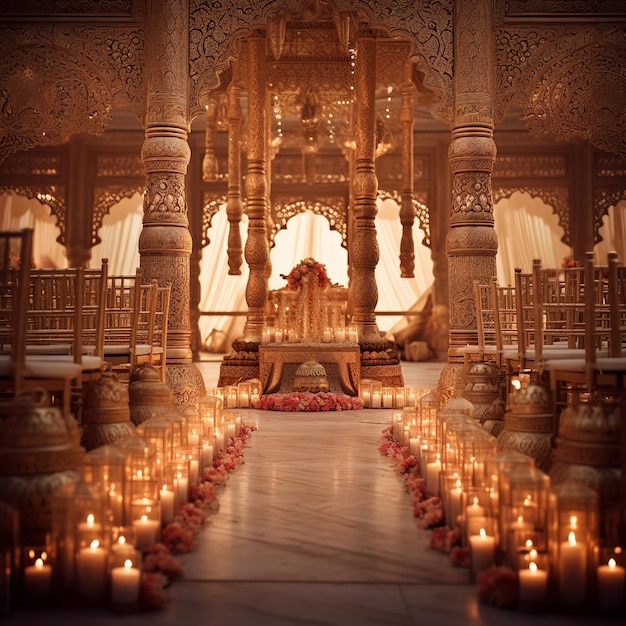
The height and width of the screenshot is (626, 626). In order to click on floor in this screenshot , I will do `click(294, 521)`.